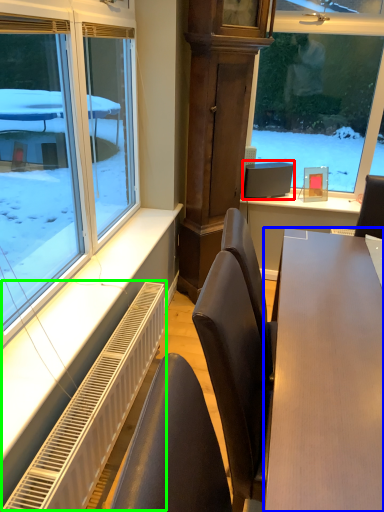
Question: Estimate the real-world distances between objects in this image. Which object is farther from computer monitor (highlighted by a red box), table (highlighted by a blue box) or radiator (highlighted by a green box)?

Choices:
 (A) table
 (B) radiator

Answer: (A)